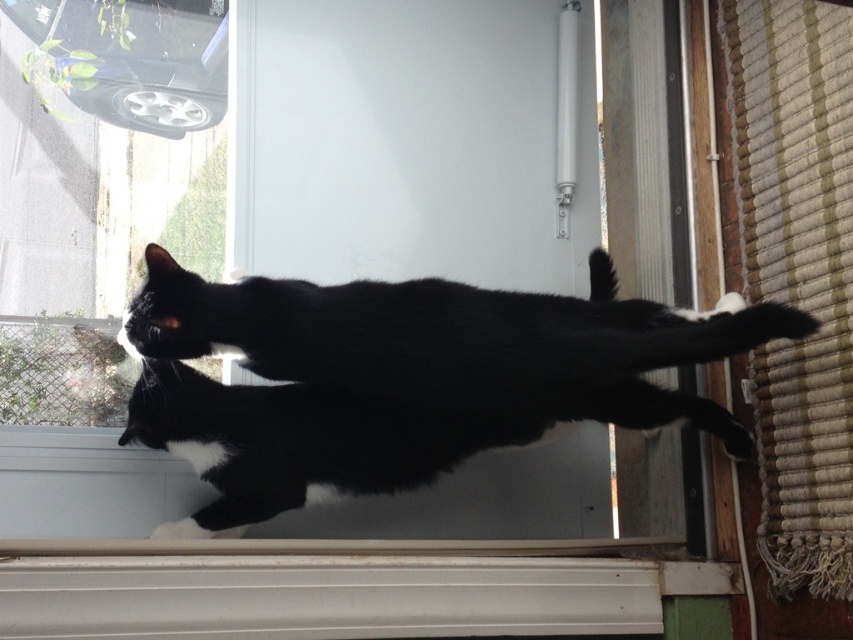
Question: Does transparent glass screen door at center come in front of black fur cat at center?

Choices:
 (A) yes
 (B) no

Answer: (B)

Question: Which of the following is the farthest from the observer?

Choices:
 (A) (532, 96)
 (B) (560, 326)

Answer: (A)

Question: Can you confirm if transparent glass screen door at center is positioned below black fur cat at center?

Choices:
 (A) no
 (B) yes

Answer: (A)

Question: Which point is farther from the camera taking this photo?

Choices:
 (A) (148, 356)
 (B) (498, 20)

Answer: (B)

Question: Can you confirm if transparent glass screen door at center is bigger than black fur cat at center?

Choices:
 (A) yes
 (B) no

Answer: (A)

Question: Which object is farther from the camera taking this photo?

Choices:
 (A) black fur cat at center
 (B) transparent glass screen door at center

Answer: (B)